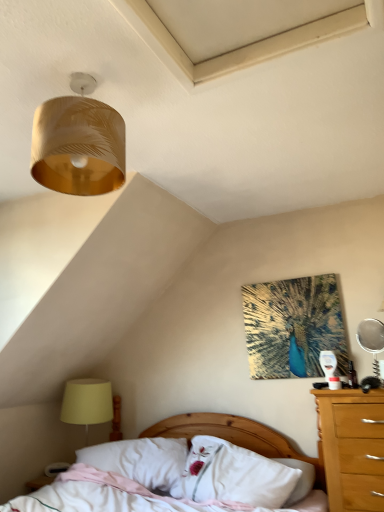
Question: Can you confirm if silver metallic mirror at right is bigger than wooden bed at lower center?

Choices:
 (A) yes
 (B) no

Answer: (B)

Question: Is silver metallic mirror at right oriented away from wooden bed at lower center?

Choices:
 (A) yes
 (B) no

Answer: (B)

Question: From a real-world perspective, is silver metallic mirror at right physically below wooden bed at lower center?

Choices:
 (A) no
 (B) yes

Answer: (A)

Question: Does silver metallic mirror at right have a smaller size compared to wooden bed at lower center?

Choices:
 (A) yes
 (B) no

Answer: (A)

Question: Is wooden bed at lower center located within silver metallic mirror at right?

Choices:
 (A) yes
 (B) no

Answer: (B)

Question: Can you confirm if silver metallic mirror at right is taller than wooden bed at lower center?

Choices:
 (A) yes
 (B) no

Answer: (B)

Question: From a real-world perspective, does white soft pillow at center, the 2th pillow when ordered from right to left, stand above gold textured lampshade at upper left?

Choices:
 (A) no
 (B) yes

Answer: (A)

Question: Is white soft pillow at center, the 2th pillow when ordered from right to left, further to the viewer compared to gold textured lampshade at upper left?

Choices:
 (A) no
 (B) yes

Answer: (B)

Question: Is white soft pillow at center, the 2th pillow when ordered from right to left, thinner than gold textured lampshade at upper left?

Choices:
 (A) yes
 (B) no

Answer: (B)

Question: From the image's perspective, is white soft pillow at center, acting as the first pillow starting from the left, below gold textured lampshade at upper left?

Choices:
 (A) yes
 (B) no

Answer: (A)

Question: Does white soft pillow at center, acting as the first pillow starting from the left, have a smaller size compared to gold textured lampshade at upper left?

Choices:
 (A) yes
 (B) no

Answer: (B)

Question: From a real-world perspective, is white soft pillow at center, the 2th pillow when ordered from right to left, below gold textured lampshade at upper left?

Choices:
 (A) yes
 (B) no

Answer: (A)

Question: Can you confirm if white soft pillow at center, which is the 1th pillow in right-to-left order, is shorter than silver metallic mirror at right?

Choices:
 (A) no
 (B) yes

Answer: (A)